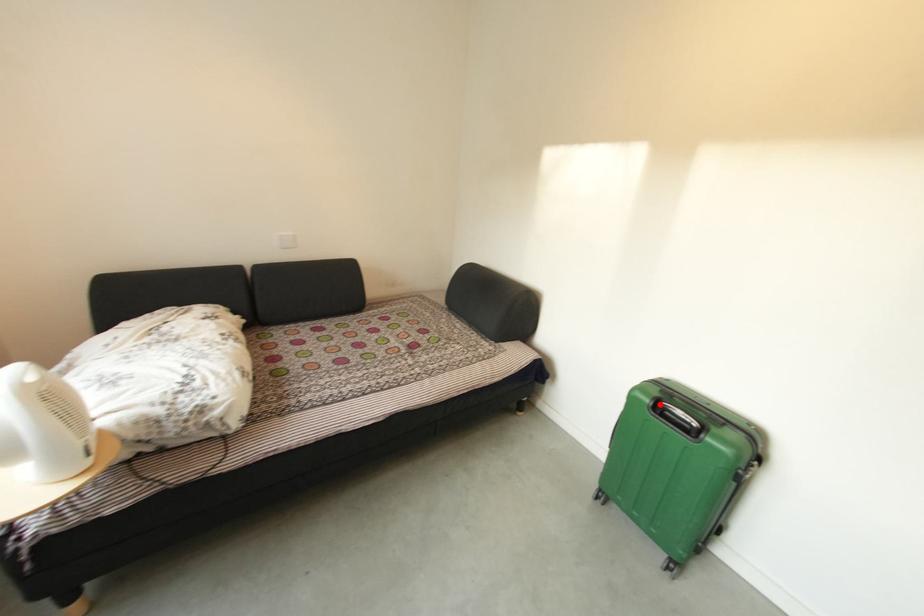
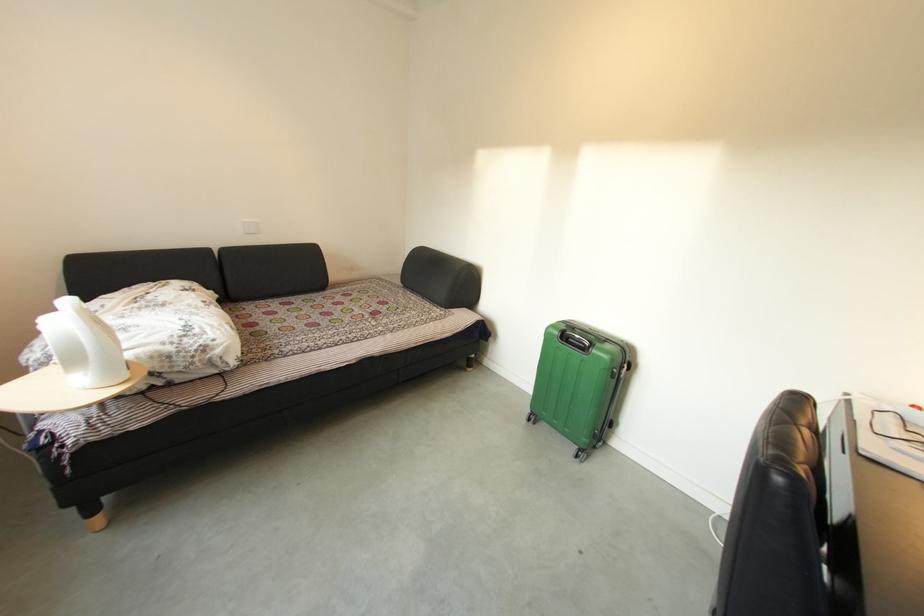
Locate, in the second image, the point that corresponds to the highlighted location in the first image.

(568, 336)